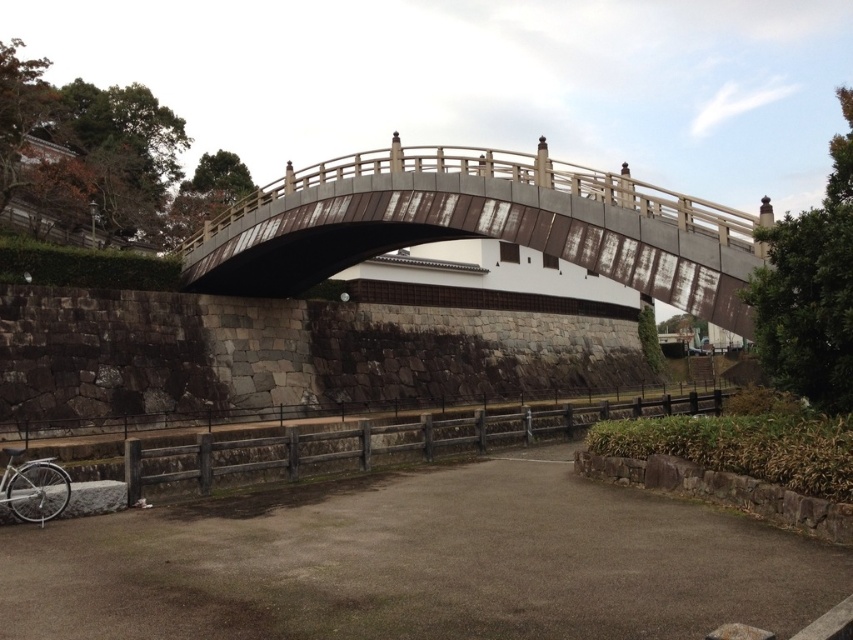
Measure the distance between dull gray asphalt at center and rusty metal bridge at center.

The distance of dull gray asphalt at center from rusty metal bridge at center is 14.48 meters.

Can you confirm if dull gray asphalt at center is positioned to the left of rusty metal bridge at center?

In fact, dull gray asphalt at center is to the right of rusty metal bridge at center.

Who is more distant from viewer, [141,536] or [543,161]?

Positioned behind is point [543,161].

This screenshot has height=640, width=853. Identify the location of dull gray asphalt at center. (418, 563).

Is wooden fence at lower center to the left of silver metallic bicycle at lower left from the viewer's perspective?

No, wooden fence at lower center is not to the left of silver metallic bicycle at lower left.

You are a GUI agent. You are given a task and a screenshot of the screen. Output one action in this format:
    pyautogui.click(x=<x>, y=<y>)
    Task: Click on the wooden fence at lower center
    
    Given the screenshot: What is the action you would take?
    pyautogui.click(x=383, y=440)

Is point (440, 541) farther from camera compared to point (558, 432)?

No, it is in front of (558, 432).

In the scene shown: Does dull gray asphalt at center appear on the right side of wooden fence at lower center?

Incorrect, dull gray asphalt at center is not on the right side of wooden fence at lower center.

Which is behind, point (631, 522) or point (641, 400)?

Point (641, 400)

In order to click on dull gray asphalt at center in this screenshot , I will do `click(418, 563)`.